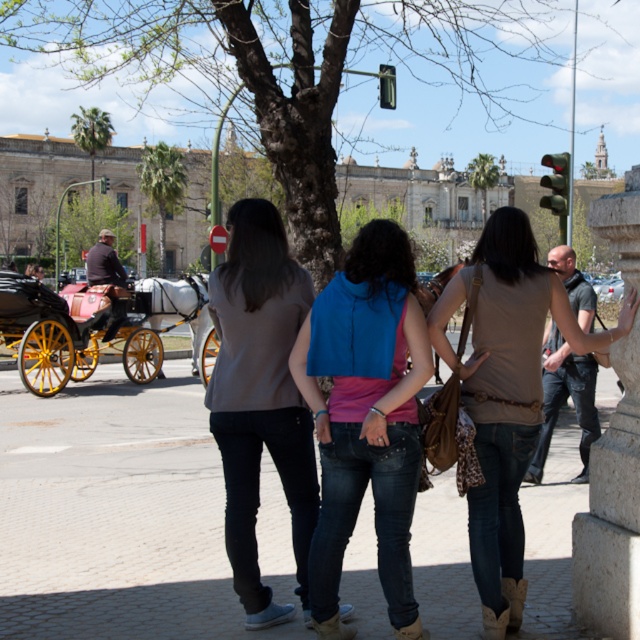
You are a tourist standing in the middle of the cobblestone pavement at center and want to take a photo of the brown leather coach at left. Since the coach is farther away, how should you adjust your camera settings to ensure it is in focus?

The cobblestone pavement at center is closer to the viewer than the brown leather coach at left. To focus on the coach, you should adjust your camera to focus on a distant object.

You are a photographer standing in the scene and want to take a photo of both the blue denim vest at center and the yellow wooden wheels at left. Which object will appear larger in the photo?

The blue denim vest at center will appear larger in the photo because it is closer to the viewer than the yellow wooden wheels at left.